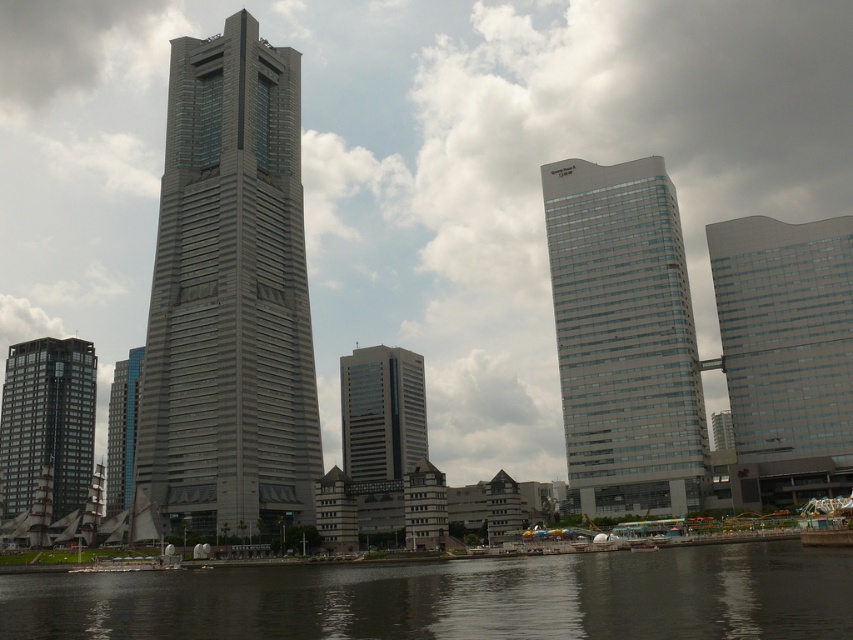
Question: Which point appears farthest from the camera in this image?

Choices:
 (A) (834, 432)
 (B) (22, 612)
 (C) (24, 417)
 (D) (119, 467)

Answer: (C)

Question: Considering the real-world distances, which object is farthest from the dark gray glass building at left?

Choices:
 (A) gray glass skyscraper at center
 (B) gray glass skyscraper at left

Answer: (B)

Question: Does gray glass skyscraper at left appear on the left side of smooth glass skyscraper at right?

Choices:
 (A) no
 (B) yes

Answer: (B)

Question: Among these objects, which one is nearest to the camera?

Choices:
 (A) dark gray water at lower center
 (B) gray glass skyscraper at left

Answer: (A)

Question: Does gray glass skyscraper at left appear over dark gray water at lower center?

Choices:
 (A) yes
 (B) no

Answer: (A)

Question: Can you confirm if dark gray water at lower center is smaller than glassy blue skyscraper at left?

Choices:
 (A) no
 (B) yes

Answer: (A)